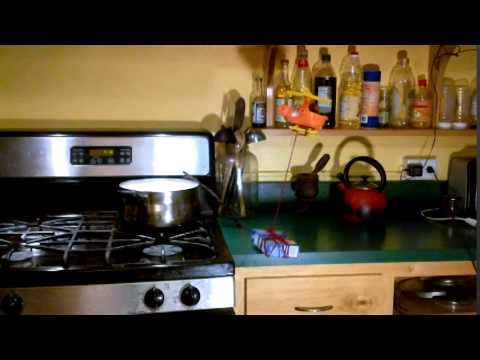
Locate an element on the screen. The height and width of the screenshot is (360, 480). range is located at coordinates (100, 241).